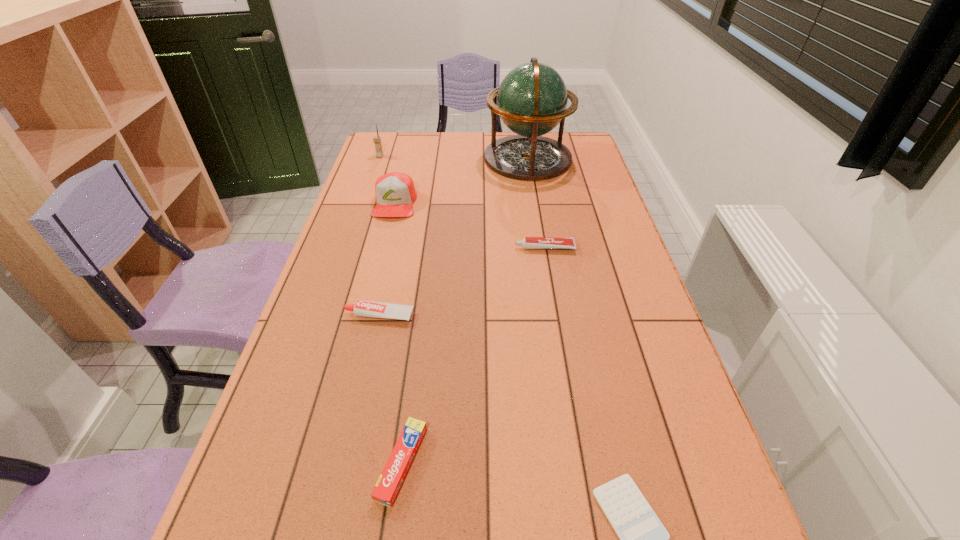
I want to click on vacant area at the left edge of the desktop, so click(x=383, y=174).

In the image, there is a desktop. At what (x,y) coordinates should I click in order to perform the action: click on vacant space at the right edge. Please return your answer as a coordinate pair (x, y). The height and width of the screenshot is (540, 960). Looking at the image, I should click on (627, 323).

The image size is (960, 540). In the image, there is a desktop. In order to click on vacant space at the far left corner in this screenshot , I will do `click(388, 133)`.

Find the location of a particular element. This screenshot has width=960, height=540. free space at the far right corner of the desktop is located at coordinates (546, 137).

You are a GUI agent. You are given a task and a screenshot of the screen. Output one action in this format:
    pyautogui.click(x=<x>, y=<y>)
    Task: Click on the empty space that is in between the fifth nearest object and the rightmost toothpaste
    The image size is (960, 540).
    Given the screenshot: What is the action you would take?
    pyautogui.click(x=469, y=226)

Image resolution: width=960 pixels, height=540 pixels. What are the coordinates of `vacant point located between the second nearest toothpaste and the second tallest object` in the screenshot? It's located at (379, 237).

Find the location of a particular element. Image resolution: width=960 pixels, height=540 pixels. free area in between the third tallest object and the farthest toothpaste is located at coordinates (469, 226).

This screenshot has width=960, height=540. What are the coordinates of `free spot between the sixth tallest object and the fifth farthest object` in the screenshot? It's located at (391, 389).

Locate an element on the screen. The height and width of the screenshot is (540, 960). empty space between the second farthest toothpaste and the leftmost object is located at coordinates (379, 237).

The image size is (960, 540). Find the location of `vacant space that's between the globe and the fifth farthest object`. vacant space that's between the globe and the fifth farthest object is located at coordinates (453, 237).